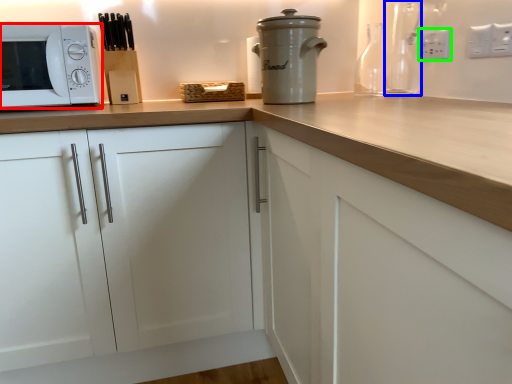
Question: Which is nearer to the microwave oven (highlighted by a red box)? bottle (highlighted by a blue box) or electric outlet (highlighted by a green box).

Choices:
 (A) bottle
 (B) electric outlet

Answer: (A)